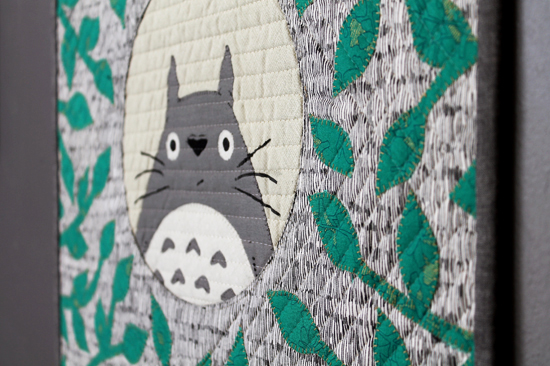
This screenshot has width=550, height=366. What are the coordinates of `white/black/grey colored pattern on art piece` in the screenshot? It's located at (394, 85), (312, 272), (111, 207).